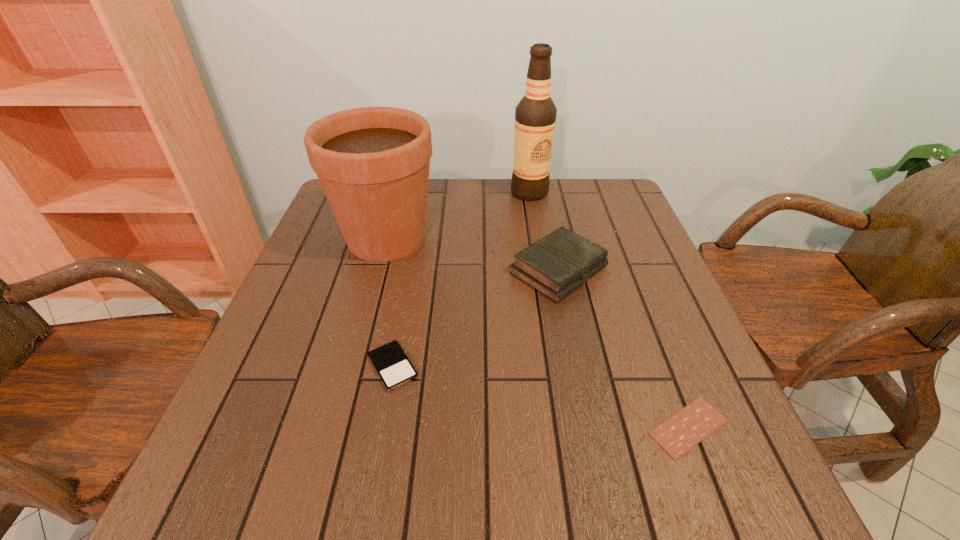
Find the location of a particular element. vacant position located on the front of the book is located at coordinates (574, 343).

The image size is (960, 540). What are the coordinates of `vacant space situated 0.190m on the back of the iPod` in the screenshot? It's located at (409, 281).

I want to click on vacant area located on the back of the chocolate bar, so click(x=639, y=300).

The height and width of the screenshot is (540, 960). What are the coordinates of `alcohol positioned at the far edge` in the screenshot? It's located at (535, 115).

The width and height of the screenshot is (960, 540). In order to click on flowerpot at the far edge in this screenshot , I will do `click(373, 163)`.

In order to click on object situated at the left edge in this screenshot , I will do `click(373, 163)`.

Identify the location of book that is at the right edge. (557, 264).

Image resolution: width=960 pixels, height=540 pixels. I want to click on chocolate bar located in the right edge section of the desktop, so click(686, 428).

What are the coordinates of `object located in the far left corner section of the desktop` in the screenshot? It's located at (373, 163).

Where is `vacant position at the far edge of the desktop`? vacant position at the far edge of the desktop is located at coordinates (484, 196).